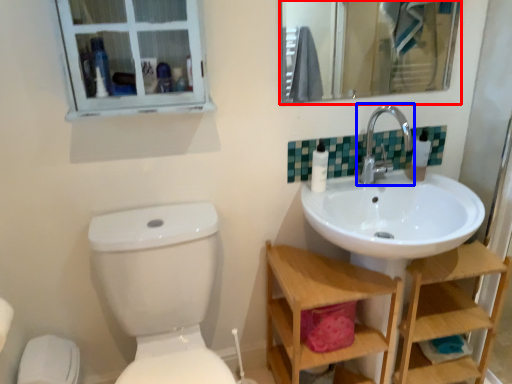
Question: Which of the following is the farthest to the observer, mirror (highlighted by a red box) or tap (highlighted by a blue box)?

Choices:
 (A) mirror
 (B) tap

Answer: (A)